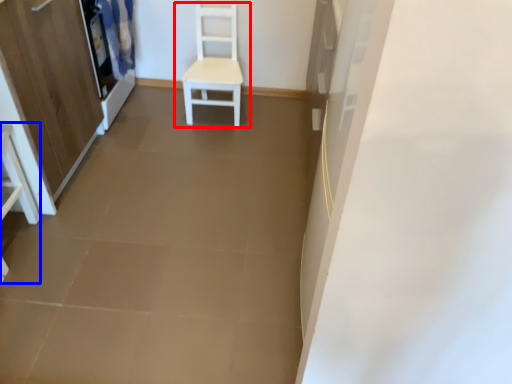
Question: Among these objects, which one is farthest to the camera, chair (highlighted by a red box) or vanity (highlighted by a blue box)?

Choices:
 (A) chair
 (B) vanity

Answer: (A)